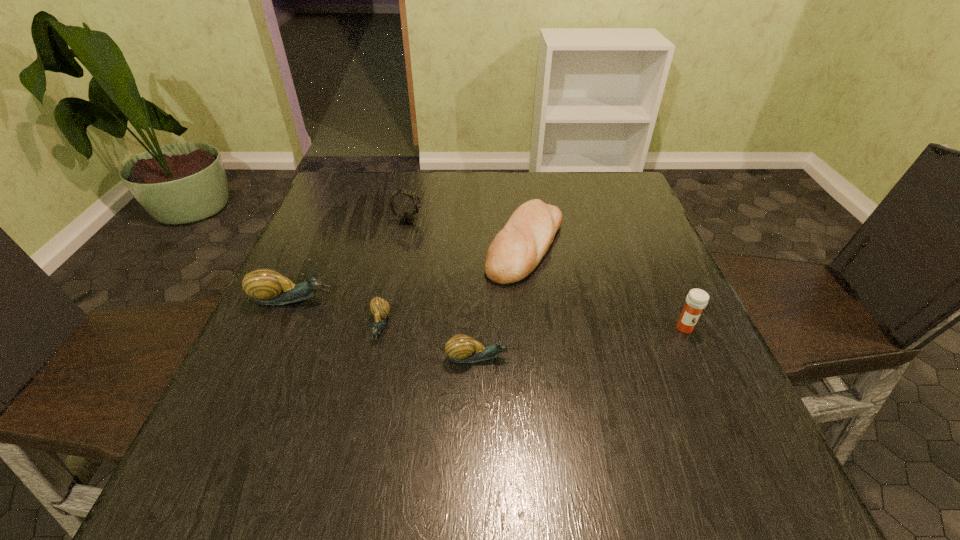
The image size is (960, 540). I want to click on free space between the leftmost object and the bread, so pos(409,272).

Image resolution: width=960 pixels, height=540 pixels. I want to click on vacant space that is in between the watch and the leftmost object, so click(x=350, y=260).

Find the location of a particular element. This screenshot has width=960, height=540. unoccupied position between the bread and the nearest object is located at coordinates (502, 301).

You are a GUI agent. You are given a task and a screenshot of the screen. Output one action in this format:
    pyautogui.click(x=<x>, y=<y>)
    Task: Click on the unoccupied area between the bread and the shortest escargot
    Image resolution: width=960 pixels, height=540 pixels.
    Given the screenshot: What is the action you would take?
    pyautogui.click(x=452, y=286)

Find the location of `vacant space that's between the second escargot from right to left and the watch`. vacant space that's between the second escargot from right to left and the watch is located at coordinates (394, 274).

Locate an element on the screen. object that is the second closest to the bread is located at coordinates (461, 348).

Where is `object that stands as the second closest to the rightmost object`? This screenshot has width=960, height=540. object that stands as the second closest to the rightmost object is located at coordinates (461, 348).

Identify which escargot is located as the second nearest to the rightmost object. Please provide its 2D coordinates. Your answer should be formatted as a tuple, i.e. [(x, y)], where the tuple contains the x and y coordinates of a point satisfying the conditions above.

[(380, 308)]

Identify which escargot is the third closest to the watch. Please provide its 2D coordinates. Your answer should be formatted as a tuple, i.e. [(x, y)], where the tuple contains the x and y coordinates of a point satisfying the conditions above.

[(461, 348)]